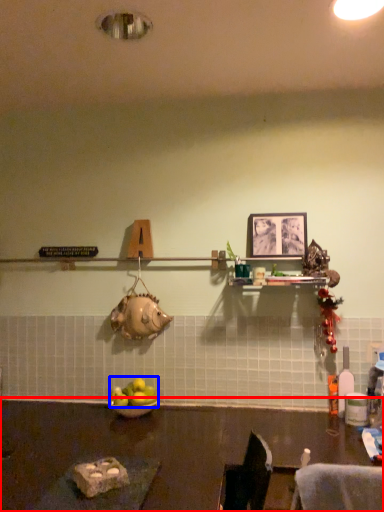
Question: Which point is further to the camera, table (highlighted by a red box) or apple (highlighted by a blue box)?

Choices:
 (A) table
 (B) apple

Answer: (B)